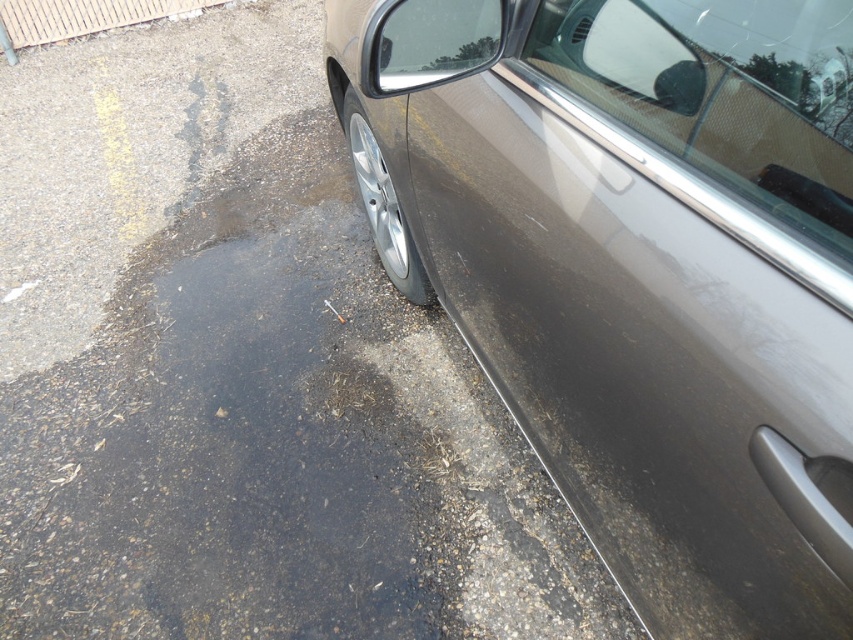
Question: Which point is farther to the camera?

Choices:
 (A) dull metallic mud at lower left
 (B) satin metallic car door at center-right

Answer: (A)

Question: Does satin metallic car door at center-right have a greater width compared to dull metallic mud at lower left?

Choices:
 (A) no
 (B) yes

Answer: (A)

Question: Among these objects, which one is nearest to the camera?

Choices:
 (A) dull metallic mud at lower left
 (B) satin metallic car door at center-right

Answer: (B)

Question: Is satin metallic car door at center-right positioned before dull metallic mud at lower left?

Choices:
 (A) no
 (B) yes

Answer: (B)

Question: Can you confirm if satin metallic car door at center-right is positioned to the right of dull metallic mud at lower left?

Choices:
 (A) no
 (B) yes

Answer: (B)